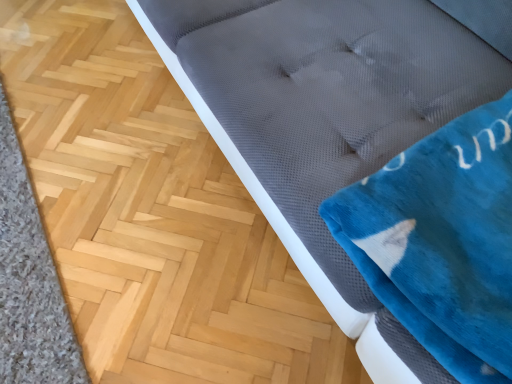
What are the coordinates of `blank space situated above gray carpet at lower left (from a real-world perspective)` in the screenshot? It's located at (13, 237).